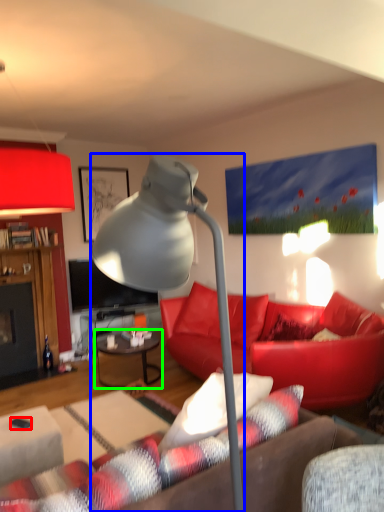
Question: Which is farther away from corded phone (highlighted by a red box)? lamp (highlighted by a blue box) or table (highlighted by a green box)?

Choices:
 (A) lamp
 (B) table

Answer: (B)